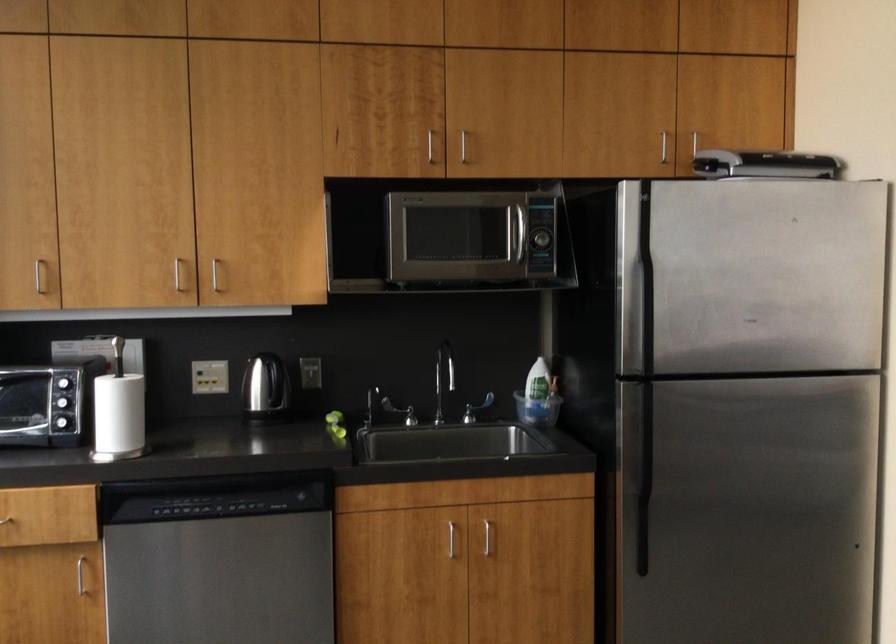
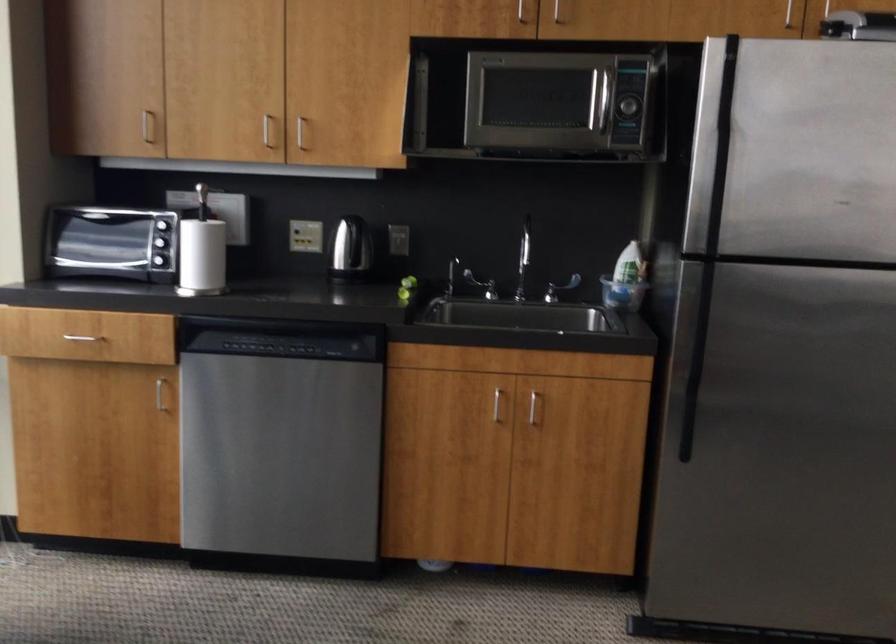
Where in the second image is the point corresponding to point 213,277 from the first image?

(300, 131)